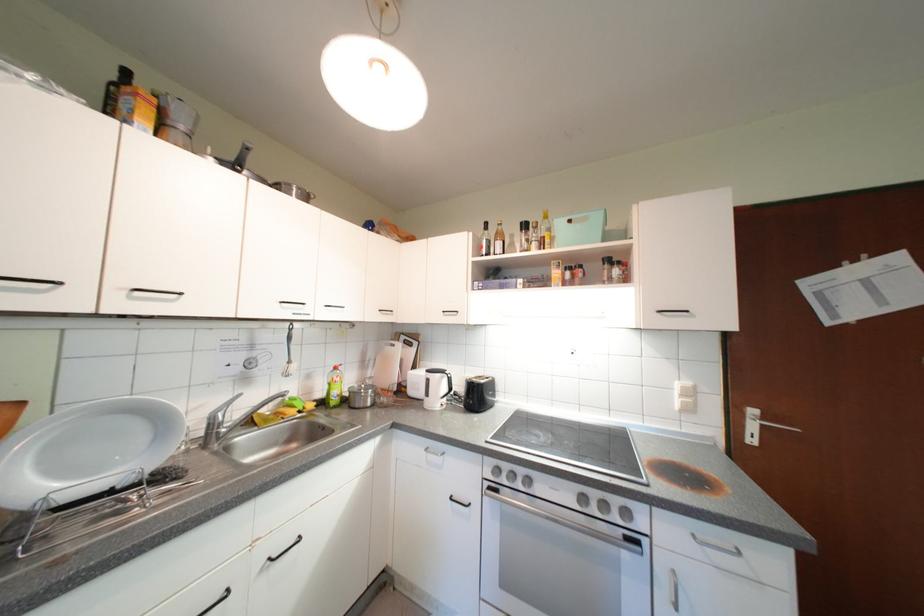
Locate an element on the screen. This screenshot has width=924, height=616. oven door handle is located at coordinates [x=574, y=525].